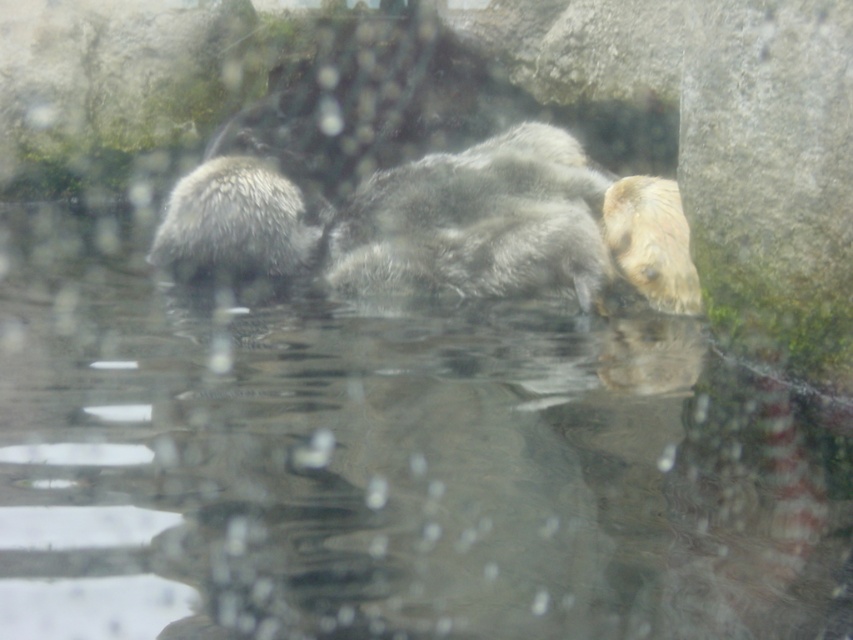
You are observing the sea otters in their enclosure. There are two points marked in the scene. Which point, point (196, 419) or point (283, 204), is closer to you?

Point (196, 419) is closer to the viewer than point (283, 204).

You are a zookeeper observing the sea otters in their enclosure. You notice the clear water at center and the fuzzy white otter at left. Which object is positioned lower in the enclosure?

The clear water at center is located below the fuzzy white otter at left, so the clear water at center is positioned lower in the enclosure.

You are a zookeeper who needs to ensure the otters have enough space to swim freely. The enclosure guidelines require at least 40 inches of open water between any two otters. Based on the image, do the clear water at center and fuzzy white otter at left meet this requirement?

The clear water at center and fuzzy white otter at left are 39.15 inches apart, which is less than the required 40 inches. Therefore, they do not meet the enclosure guidelines for sufficient swimming space.